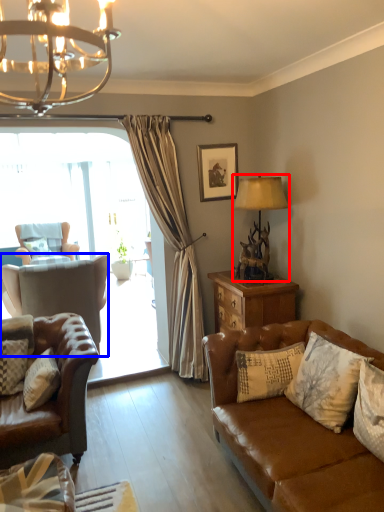
Question: Which point is closer to the camera, lamp (highlighted by a red box) or chair (highlighted by a blue box)?

Choices:
 (A) lamp
 (B) chair

Answer: (A)